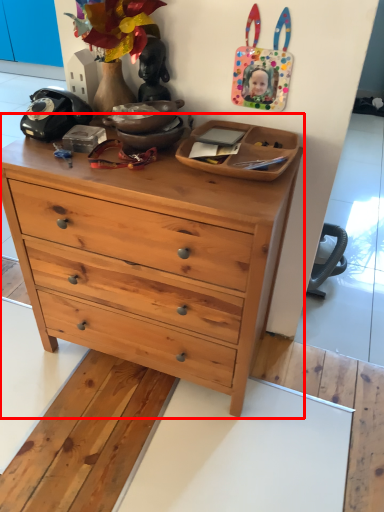
Question: From the image's perspective, considering the relative positions of chest of drawers (annotated by the red box) and cabinetry in the image provided, where is chest of drawers (annotated by the red box) located with respect to the staircase?

Choices:
 (A) above
 (B) below

Answer: (B)